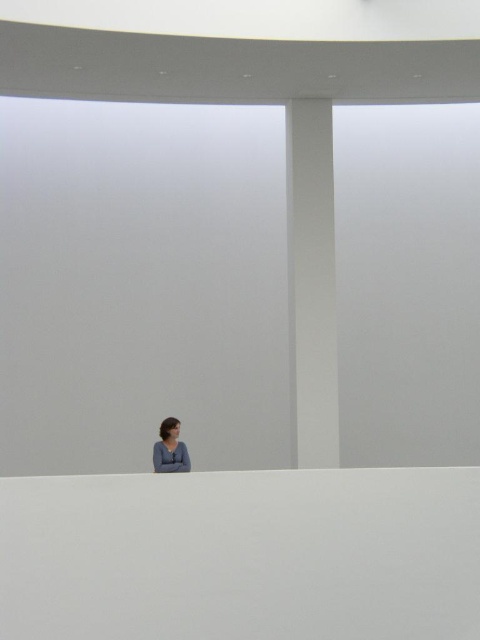
You are standing at the point with coordinates point (x=190, y=467) and want to walk towards the point with coordinates point (x=297, y=433). Will you be moving forward or backward in the scene?

Since point (x=297, y=433) is behind point (x=190, y=467), moving towards it would require moving backward in the scene.

You are standing at the edge of the platform looking towards the white smooth pillar at right and the matte gray sweater at lower center. Which object is positioned to the right side from your viewpoint?

The white smooth pillar at right is positioned to the right of the matte gray sweater at lower center from your viewpoint.

You are an architect designing a new sculpture garden. You need to place a new statue that is 1.5 meters wide between the white smooth pillar at right and the matte gray sweater at lower center. Based on the scene, will the statue fit between them?

The white smooth pillar at right is wider than the matte gray sweater at lower center. However, the exact distance between them isn